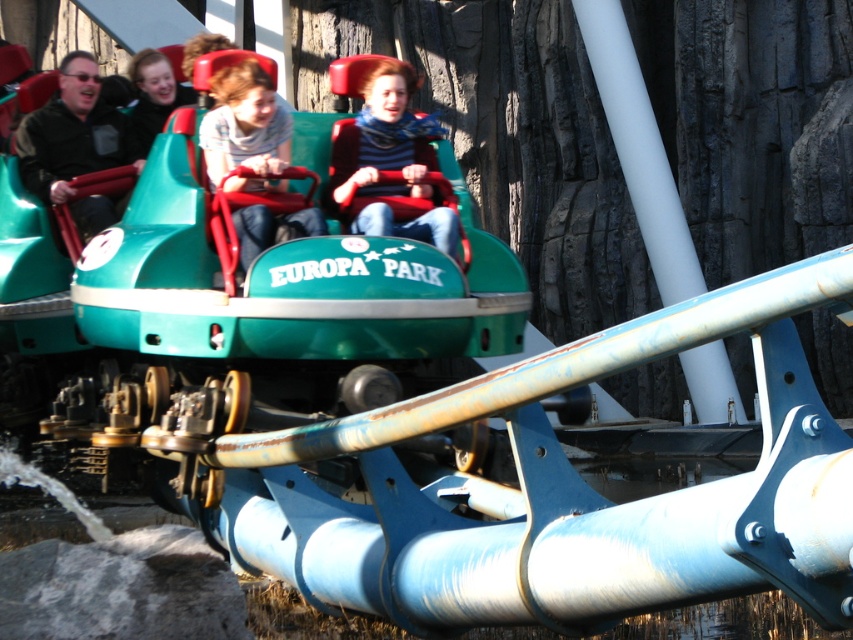
Which is in front, point (67, 80) or point (259, 131)?

Positioned in front is point (259, 131).

Is point (90, 202) closer to viewer compared to point (247, 182)?

No, it is behind (247, 182).

What do you see at coordinates (76, 145) in the screenshot? The image size is (853, 640). I see `matte black jacket at left` at bounding box center [76, 145].

You are a GUI agent. You are given a task and a screenshot of the screen. Output one action in this format:
    pyautogui.click(x=<x>, y=<y>)
    Task: Click on the matte black jacket at left
    The height and width of the screenshot is (640, 853).
    Given the screenshot: What is the action you would take?
    pyautogui.click(x=76, y=145)

Measure the distance between point (67, 166) and camera.

Point (67, 166) and camera are 14.88 meters apart.

From the picture: Which is more to the right, matte black jacket at left or matte black jacket at upper left?

From the viewer's perspective, matte black jacket at upper left appears more on the right side.

Is point (131, 148) farther from viewer compared to point (166, 67)?

No.

The width and height of the screenshot is (853, 640). I want to click on matte black jacket at left, so click(x=76, y=145).

What do you see at coordinates (260, 298) in the screenshot? The image size is (853, 640). I see `green matte bumper car at center` at bounding box center [260, 298].

Does green matte bumper car at center have a larger size compared to matte black jacket at left?

Correct, green matte bumper car at center is larger in size than matte black jacket at left.

Is point (469, 234) less distant than point (96, 148)?

Yes.

Locate an element on the screen. The image size is (853, 640). green matte bumper car at center is located at coordinates (260, 298).